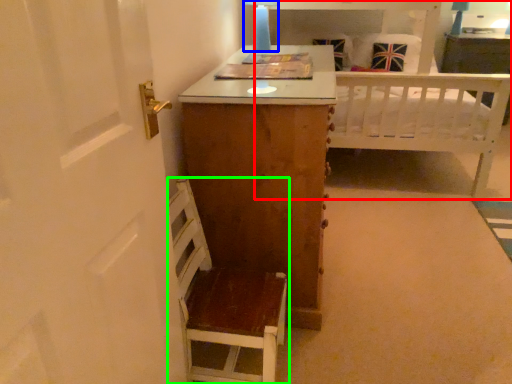
Question: Based on their relative distances, which object is nearer to bed (highlighted by a red box)? Choose from table lamp (highlighted by a blue box) and furniture (highlighted by a green box).

Choices:
 (A) table lamp
 (B) furniture

Answer: (A)